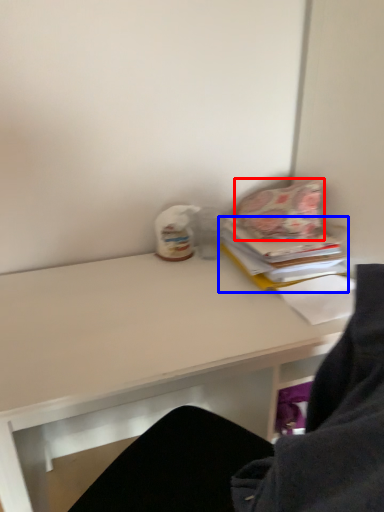
Question: Among these objects, which one is farthest to the camera, pillow (highlighted by a red box) or paperback book (highlighted by a blue box)?

Choices:
 (A) pillow
 (B) paperback book

Answer: (A)